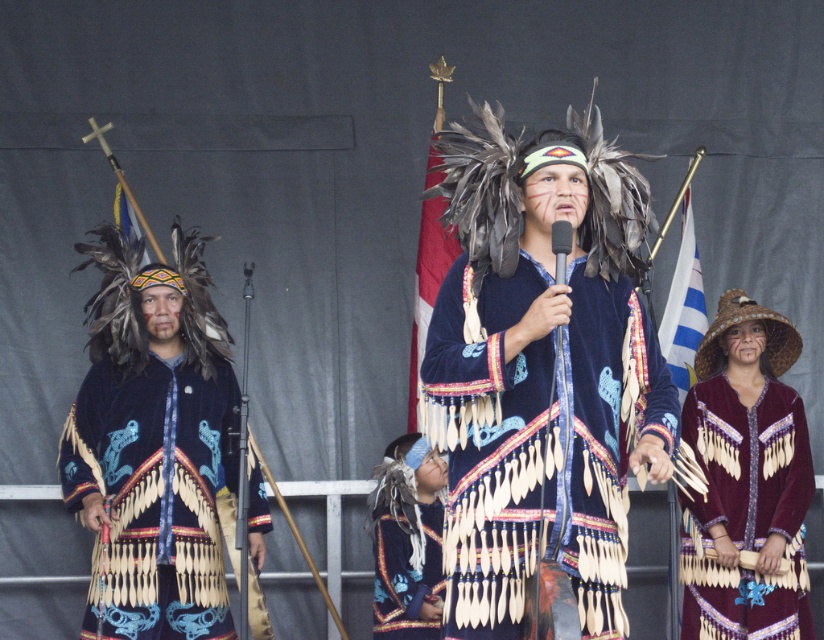
Question: Considering the relative positions of velvet blue headdress at center and maroon velvet dress at lower right in the image provided, where is velvet blue headdress at center located with respect to maroon velvet dress at lower right?

Choices:
 (A) left
 (B) right

Answer: (A)

Question: Which object is the closest to the velvet blue vest at center?

Choices:
 (A) maroon velvet dress at lower right
 (B) velvet blue coat with fringe at left
 (C) velvet blue headdress at center

Answer: (B)

Question: Among these points, which one is farthest from the camera?

Choices:
 (A) (412, 621)
 (B) (487, 337)
 (C) (153, 314)

Answer: (C)

Question: From the image, what is the correct spatial relationship of velvet blue coat with fringe at left in relation to velvet blue vest at center?

Choices:
 (A) above
 (B) below

Answer: (A)

Question: Is velvet blue headdress at center positioned at the back of velvet blue vest at center?

Choices:
 (A) yes
 (B) no

Answer: (B)

Question: Which object appears closest to the camera in this image?

Choices:
 (A) velvet blue coat with fringe at left
 (B) velvet blue vest at center
 (C) maroon velvet dress at lower right
 (D) velvet blue headdress at center

Answer: (D)